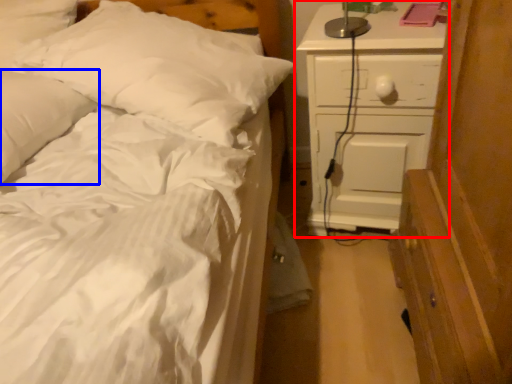
Question: Among these objects, which one is nearest to the camera, chest of drawers (highlighted by a red box) or pillow (highlighted by a blue box)?

Choices:
 (A) chest of drawers
 (B) pillow

Answer: (B)